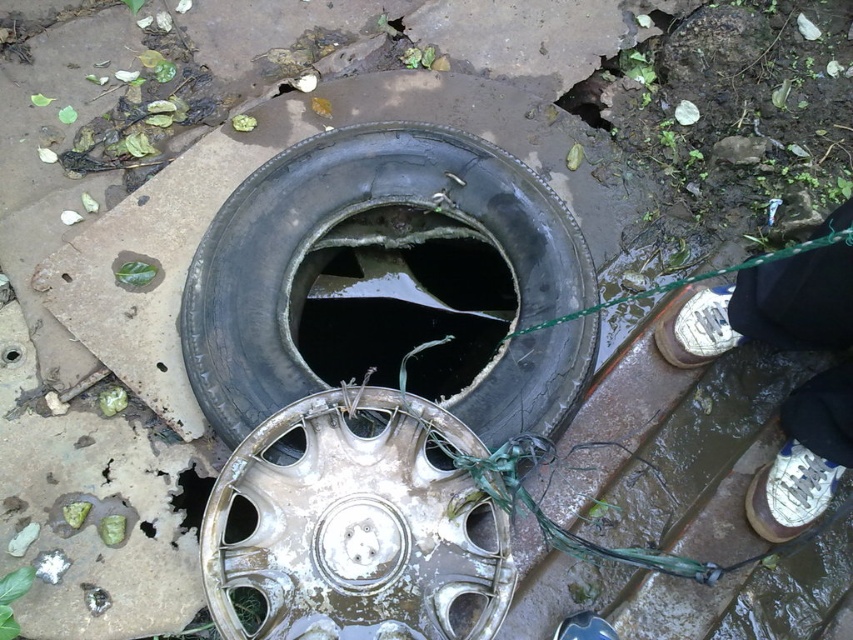
Between point (401, 612) and point (695, 355), which one is positioned in front?

Positioned in front is point (401, 612).

Which is below, silver metallic hubcap at center or white leather shoe at right?

Positioned lower is silver metallic hubcap at center.

Is point (320, 634) more distant than point (717, 333)?

No, (320, 634) is closer to viewer.

The width and height of the screenshot is (853, 640). I want to click on silver metallic hubcap at center, so click(x=357, y=525).

Between black rubber hole at center and white leather sneakers at lower right, which one is positioned lower?

Positioned lower is white leather sneakers at lower right.

Is black rubber hole at center to the left of white leather sneakers at lower right from the viewer's perspective?

Indeed, black rubber hole at center is positioned on the left side of white leather sneakers at lower right.

Where is `black rubber hole at center`? The height and width of the screenshot is (640, 853). black rubber hole at center is located at coordinates (402, 300).

Where is `black rubber hole at center`? The height and width of the screenshot is (640, 853). black rubber hole at center is located at coordinates 402,300.

Does white leather sneakers at lower right appear on the left side of white leather shoe at lower right?

Incorrect, white leather sneakers at lower right is not on the left side of white leather shoe at lower right.

Does white leather sneakers at lower right have a lesser height compared to white leather shoe at lower right?

In fact, white leather sneakers at lower right may be taller than white leather shoe at lower right.

The height and width of the screenshot is (640, 853). In order to click on white leather sneakers at lower right in this screenshot , I will do `click(766, 308)`.

At what (x,y) coordinates should I click in order to perform the action: click on white leather sneakers at lower right. Please return your answer as a coordinate pair (x, y). The image size is (853, 640). Looking at the image, I should click on (766, 308).